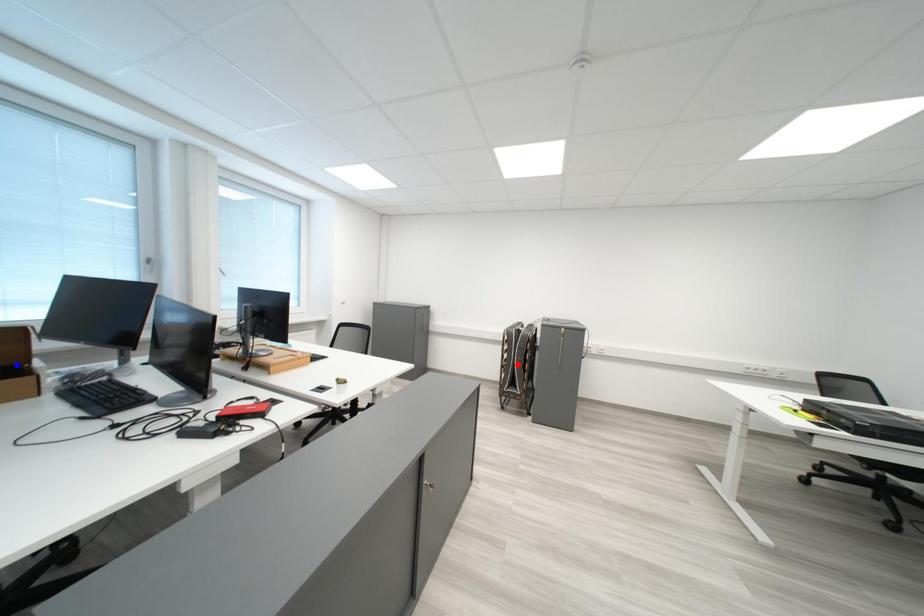
Question: Which of the two points in the image is closer to the camera?

Choices:
 (A) Blue point is closer.
 (B) Red point is closer.

Answer: (A)